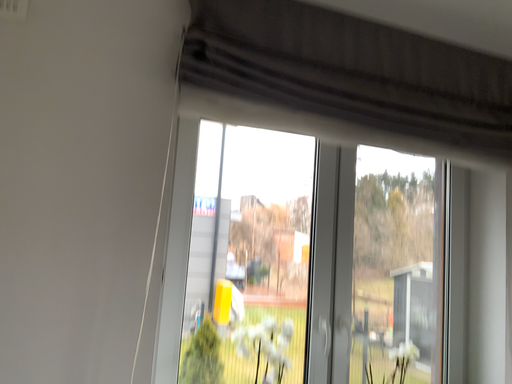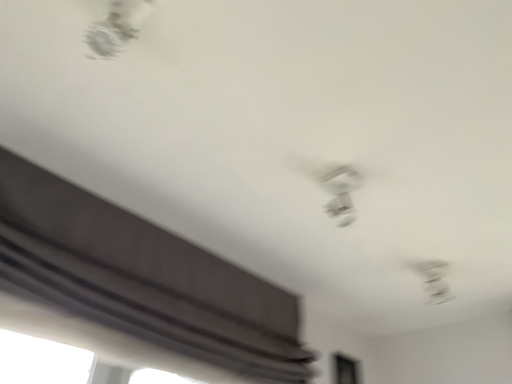
Question: How did the camera likely rotate when shooting the video?

Choices:
 (A) rotated downward
 (B) rotated upward

Answer: (B)